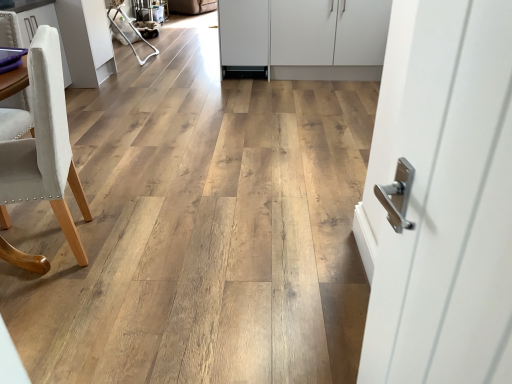
Question: Would you say light beige fabric chair at left contains white matte cabinet at center, the first cabinetry in the right-to-left sequence?

Choices:
 (A) no
 (B) yes

Answer: (A)

Question: From the image's perspective, is light beige fabric chair at left beneath white matte cabinet at center, which is the second cabinetry from front to back?

Choices:
 (A) no
 (B) yes

Answer: (B)

Question: Is light beige fabric chair at left turned away from white matte cabinet at center, the first cabinetry positioned from the back?

Choices:
 (A) no
 (B) yes

Answer: (A)

Question: Does light beige fabric chair at left have a larger size compared to white matte cabinet at center, which is the second cabinetry from front to back?

Choices:
 (A) no
 (B) yes

Answer: (A)

Question: From the image's perspective, is light beige fabric chair at left over white matte cabinet at center, the first cabinetry positioned from the back?

Choices:
 (A) no
 (B) yes

Answer: (A)

Question: Considering the relative sizes of light beige fabric chair at left and white matte cabinet at center, which ranks as the second cabinetry in left-to-right order, in the image provided, is light beige fabric chair at left smaller than white matte cabinet at center, which ranks as the second cabinetry in left-to-right order,?

Choices:
 (A) no
 (B) yes

Answer: (B)

Question: Is white fabric armchair at upper left far from white fabric chair at left, acting as the 2th cabinetry starting from the back?

Choices:
 (A) no
 (B) yes

Answer: (B)

Question: From the image's perspective, is white fabric armchair at upper left located beneath white fabric chair at left, positioned as the 2th cabinetry in right-to-left order?

Choices:
 (A) no
 (B) yes

Answer: (A)

Question: Is white fabric armchair at upper left to the right of white fabric chair at left, placed as the first cabinetry when sorted from left to right, from the viewer's perspective?

Choices:
 (A) no
 (B) yes

Answer: (B)

Question: Considering the relative sizes of white fabric armchair at upper left and white fabric chair at left, positioned as the 2th cabinetry in right-to-left order, in the image provided, is white fabric armchair at upper left thinner than white fabric chair at left, positioned as the 2th cabinetry in right-to-left order,?

Choices:
 (A) yes
 (B) no

Answer: (B)

Question: From a real-world perspective, does white fabric armchair at upper left stand above white fabric chair at left, positioned as the 2th cabinetry in right-to-left order?

Choices:
 (A) yes
 (B) no

Answer: (B)

Question: From the image's perspective, is white fabric armchair at upper left above white fabric chair at left, acting as the 2th cabinetry starting from the back?

Choices:
 (A) no
 (B) yes

Answer: (B)

Question: Does white fabric armchair at upper left appear on the left side of light beige fabric chair at left?

Choices:
 (A) yes
 (B) no

Answer: (A)